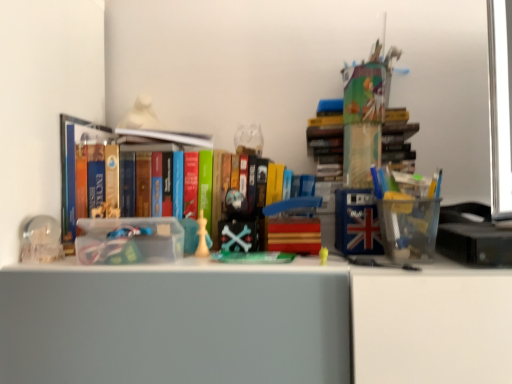
Question: Is clear plastic container at left to the left of wooden block at center, placed as the 3th toy when sorted from top to bottom, from the viewer's perspective?

Choices:
 (A) yes
 (B) no

Answer: (A)

Question: Can you confirm if clear plastic container at left is positioned to the right of wooden block at center, which ranks as the 3th toy in bottom-to-top order?

Choices:
 (A) no
 (B) yes

Answer: (A)

Question: Is clear plastic container at left placed right next to wooden block at center, the fourth toy positioned from the back?

Choices:
 (A) no
 (B) yes

Answer: (A)

Question: Is clear plastic container at left wider than wooden block at center, which is counted as the second toy, starting from the front?

Choices:
 (A) yes
 (B) no

Answer: (B)

Question: Does clear plastic container at left have a smaller size compared to wooden block at center, which is counted as the second toy, starting from the front?

Choices:
 (A) no
 (B) yes

Answer: (B)

Question: Choose the correct answer: Is shiny plastic skull at center, the 4th toy when ordered from front to back, inside matte white bust at upper center, arranged as the 1th toy when viewed from the back, or outside it?

Choices:
 (A) inside
 (B) outside

Answer: (B)

Question: Is shiny plastic skull at center, positioned as the 2th toy in back-to-front order, wider or thinner than matte white bust at upper center, which ranks as the first toy in top-to-bottom order?

Choices:
 (A) thin
 (B) wide

Answer: (A)

Question: Is shiny plastic skull at center, acting as the 3th toy starting from the right, in front of or behind matte white bust at upper center, the 5th toy ordered from the bottom, in the image?

Choices:
 (A) front
 (B) behind

Answer: (A)

Question: Considering the positions of shiny plastic skull at center, the 4th toy when ordered from front to back, and matte white bust at upper center, which is the 5th toy from front to back, in the image, is shiny plastic skull at center, the 4th toy when ordered from front to back, bigger or smaller than matte white bust at upper center, which is the 5th toy from front to back,?

Choices:
 (A) big
 (B) small

Answer: (B)

Question: Considering their positions, is matte white bust at upper center, which appears as the first toy when viewed from the left, located in front of or behind wooden block at center, placed as the 3th toy when sorted from top to bottom?

Choices:
 (A) behind
 (B) front

Answer: (A)

Question: Is matte white bust at upper center, which ranks as the first toy in top-to-bottom order, to the left or to the right of wooden block at center, which is counted as the second toy, starting from the front, in the image?

Choices:
 (A) right
 (B) left

Answer: (B)

Question: Does point (138, 107) appear closer or farther from the camera than point (301, 203)?

Choices:
 (A) closer
 (B) farther

Answer: (B)

Question: From the image's perspective, is matte white bust at upper center, which is the 5th toy from front to back, above or below wooden block at center, which is counted as the second toy, starting from the front?

Choices:
 (A) below
 (B) above

Answer: (B)

Question: From the image's perspective, relative to matte white bust at upper center, arranged as the 1th toy when viewed from the back, is white paper at center, acting as the second book starting from the bottom, above or below?

Choices:
 (A) above
 (B) below

Answer: (B)

Question: Considering the positions of point (190, 140) and point (139, 125), is point (190, 140) closer or farther from the camera than point (139, 125)?

Choices:
 (A) farther
 (B) closer

Answer: (B)